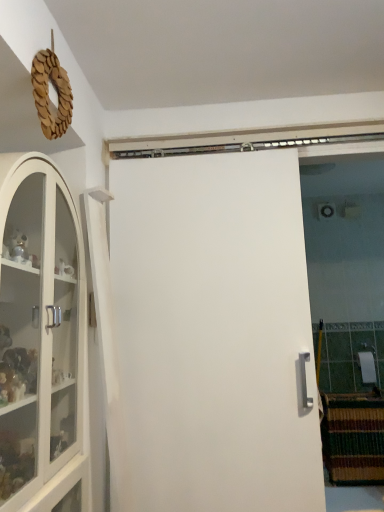
This screenshot has height=512, width=384. What do you see at coordinates (215, 333) in the screenshot? I see `white matte door at center` at bounding box center [215, 333].

Locate an element on the screen. This screenshot has width=384, height=512. white matte door at center is located at coordinates (215, 333).

The image size is (384, 512). In order to click on white glass cabinet at left in this screenshot , I will do `click(39, 331)`.

Describe the element at coordinates (39, 331) in the screenshot. Image resolution: width=384 pixels, height=512 pixels. I see `white glass cabinet at left` at that location.

Find the location of a particular element. white matte door at center is located at coordinates (215, 333).

Looking at this image, is white glass cabinet at left at the right side of white matte door at center?

No, white glass cabinet at left is not to the right of white matte door at center.

Considering the relative positions of white glass cabinet at left and white matte door at center in the image provided, is white glass cabinet at left in front of white matte door at center?

Yes.

Between point (73, 447) and point (222, 473), which one is positioned behind?

The point (222, 473) is farther from the camera.

In the scene shown: From the image's perspective, is white glass cabinet at left beneath white matte door at center?

Actually, white glass cabinet at left appears above white matte door at center in the image.

From a real-world perspective, which object rests below the other?

white matte door at center is physically lower.

Based on the photo, which of these two, white glass cabinet at left or white matte door at center, is wider?

With larger width is white glass cabinet at left.

Which of these two, white glass cabinet at left or white matte door at center, stands taller?

white matte door at center is taller.

Based on their sizes in the image, would you say white glass cabinet at left is bigger or smaller than white matte door at center?

Considering their sizes, white glass cabinet at left takes up more space than white matte door at center.

Is white matte door at center completely or partially inside white glass cabinet at left?

No.

In the scene shown: Are white glass cabinet at left and white matte door at center far apart?

They are positioned close to each other.

Is white glass cabinet at left turned away from white matte door at center?

white glass cabinet at left does not have its back to white matte door at center.

What's the angular difference between white glass cabinet at left and white matte door at center's facing directions?

90 degrees separate the facing orientations of white glass cabinet at left and white matte door at center.

The height and width of the screenshot is (512, 384). What are the coordinates of `door lying below the white glass cabinet at left (from the image's perspective)` in the screenshot? It's located at (215, 333).

Which object is positioned more to the right, white matte door at center or white glass cabinet at left?

Positioned to the right is white matte door at center.

Does white matte door at center lie behind white glass cabinet at left?

Yes, it is behind white glass cabinet at left.

Does point (299, 463) come farther from viewer compared to point (63, 450)?

Yes.

From the image's perspective, is white matte door at center beneath white glass cabinet at left?

Indeed, from the image's perspective, white matte door at center is shown beneath white glass cabinet at left.

From a real-world perspective, is white matte door at center above or below white glass cabinet at left?

white matte door at center is situated lower than white glass cabinet at left in the real world.

Considering the relative sizes of white matte door at center and white glass cabinet at left in the image provided, is white matte door at center thinner than white glass cabinet at left?

Indeed, white matte door at center has a lesser width compared to white glass cabinet at left.

Who is shorter, white matte door at center or white glass cabinet at left?

white glass cabinet at left.

Can you confirm if white matte door at center is smaller than white glass cabinet at left?

Indeed, white matte door at center has a smaller size compared to white glass cabinet at left.

Can we say white matte door at center lies outside white glass cabinet at left?

Yes, white matte door at center is not within white glass cabinet at left.

Would you consider white matte door at center to be distant from white glass cabinet at left?

white matte door at center is actually quite close to white glass cabinet at left.

Does white matte door at center turn towards white glass cabinet at left?

Yes, white matte door at center is aimed at white glass cabinet at left.

How different are the orientations of white matte door at center and white glass cabinet at left in degrees?

They differ by 90 degrees in their facing directions.

How much distance is there between white matte door at center and white glass cabinet at left?

The distance of white matte door at center from white glass cabinet at left is 22.12 inches.

Locate an element on the screen. The image size is (384, 512). cabinetry on the left of white matte door at center is located at coordinates (39, 331).

In the image, there is a white glass cabinet at left. What are the coordinates of `door below it (from the image's perspective)` in the screenshot? It's located at pos(215,333).

Image resolution: width=384 pixels, height=512 pixels. Identify the location of cabinetry located in front of the white matte door at center. (39, 331).